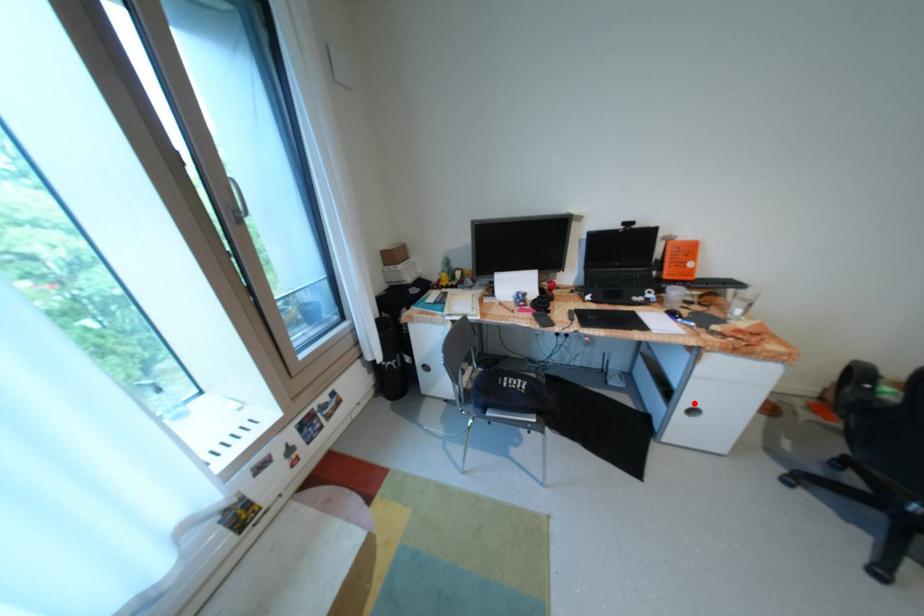
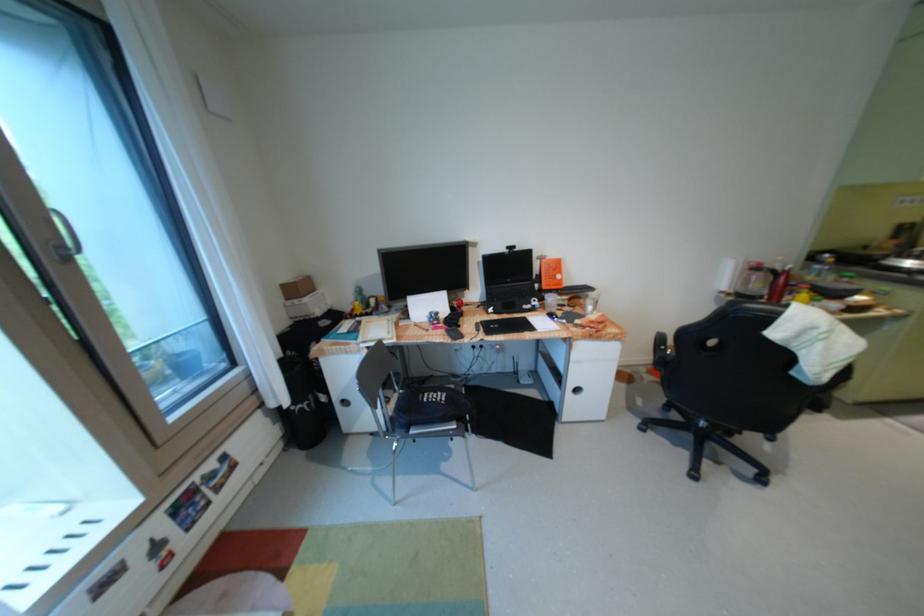
Locate, in the second image, the point that corresponds to the highlighted location in the first image.

(580, 386)